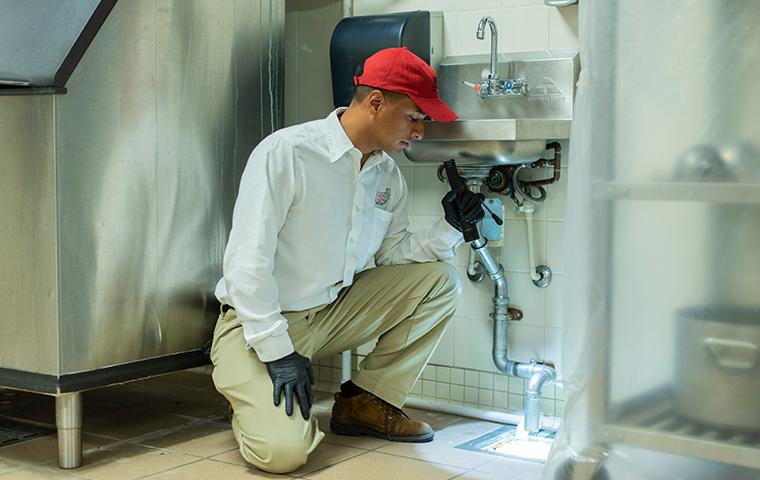
At what (x,y) coordinates should I click in order to perform the action: click on metal fixture. Please return your answer as a coordinate pair (x, y). The height and width of the screenshot is (480, 760). Looking at the image, I should click on (137, 234).